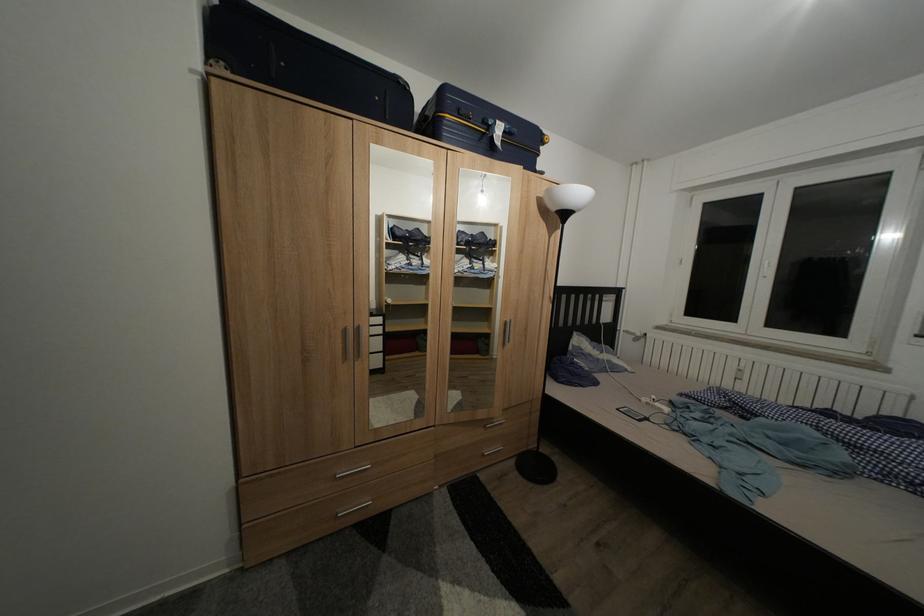
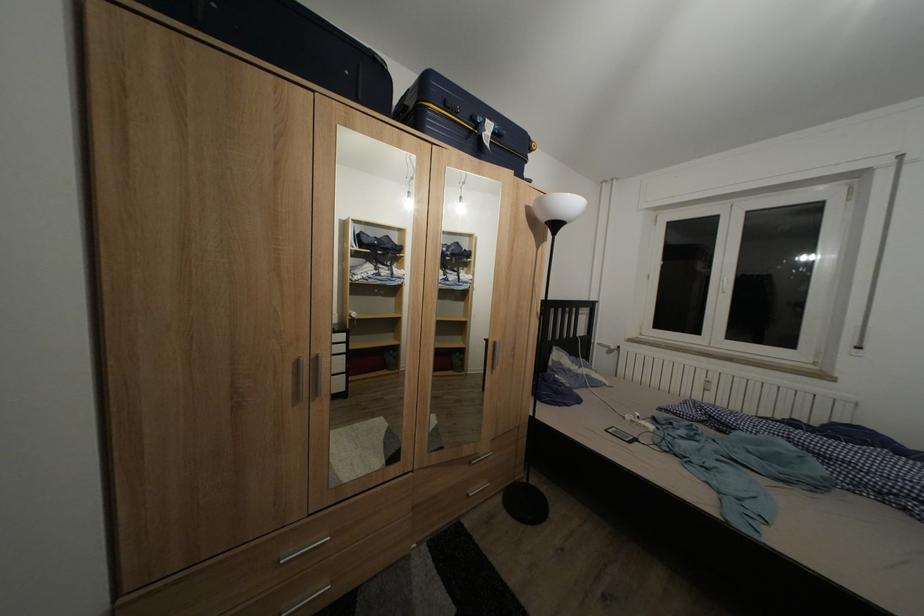
Question: How did the camera likely rotate?

Choices:
 (A) Left
 (B) Right
 (C) Up
 (D) Down

Answer: (B)